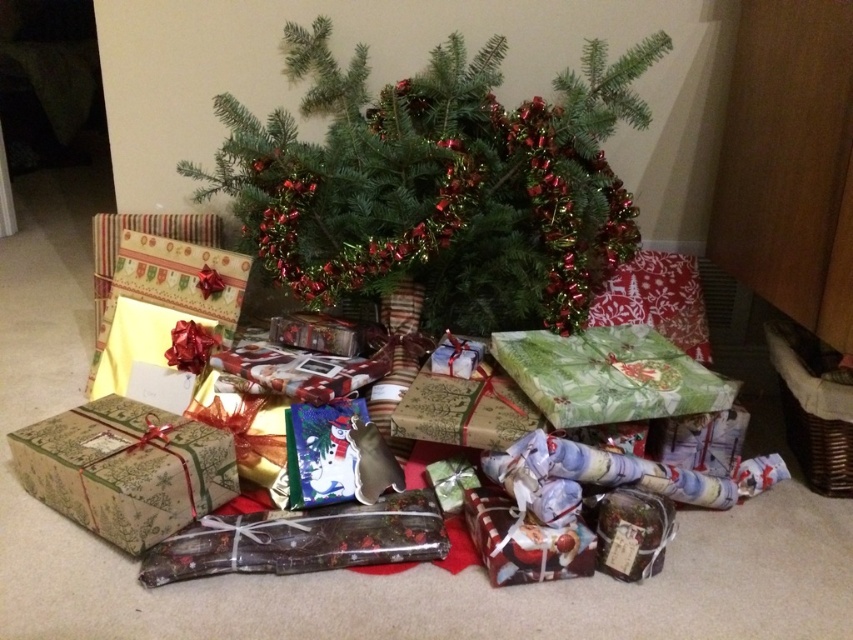
How distant is green textured christmas tree at center from matte green paper gift at lower left?

green textured christmas tree at center is 22.13 inches away from matte green paper gift at lower left.

Can you confirm if green textured christmas tree at center is positioned to the right of matte green paper gift at lower left?

Yes, green textured christmas tree at center is to the right of matte green paper gift at lower left.

Which is behind, point (279, 140) or point (20, 435)?

Positioned behind is point (279, 140).

The image size is (853, 640). Find the location of `green textured christmas tree at center`. green textured christmas tree at center is located at coordinates (439, 182).

The image size is (853, 640). Describe the element at coordinates (125, 468) in the screenshot. I see `matte green paper gift at lower left` at that location.

Measure the distance between matte green paper gift at lower left and camera.

matte green paper gift at lower left is 1.09 meters away from camera.

Image resolution: width=853 pixels, height=640 pixels. I want to click on matte green paper gift at lower left, so click(125, 468).

Based on the photo, does matte green paper gift at lower left come in front of santa-themed paper gift at center?

Yes, matte green paper gift at lower left is in front of santa-themed paper gift at center.

Identify the location of matte green paper gift at lower left. The image size is (853, 640). (125, 468).

Where is `matte green paper gift at lower left`? The height and width of the screenshot is (640, 853). matte green paper gift at lower left is located at coordinates (125, 468).